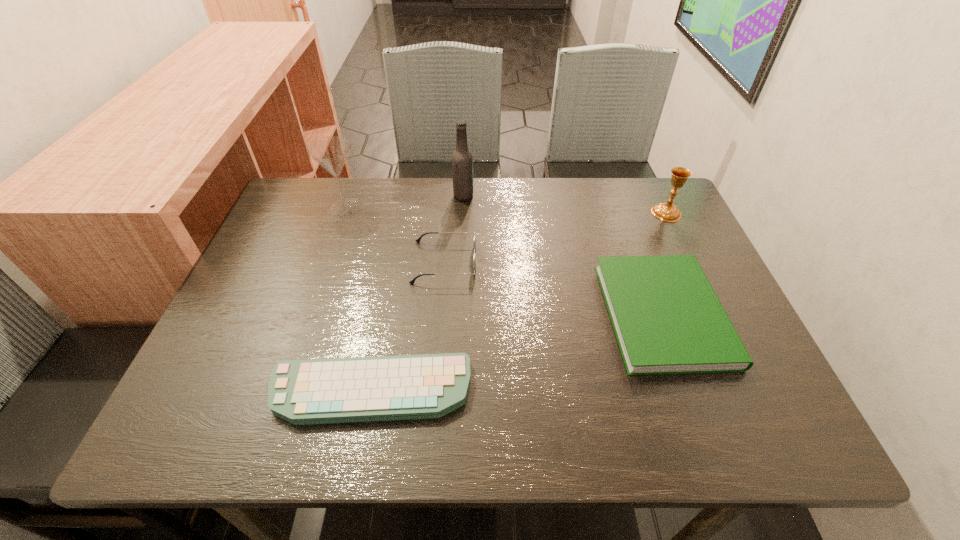
The width and height of the screenshot is (960, 540). What are the coordinates of `vacant space situated 0.290m on the back of the fifth tallest object` in the screenshot? It's located at point(619,195).

The height and width of the screenshot is (540, 960). In order to click on free space located 0.120m on the right of the shortest object in this screenshot , I will do `click(533, 390)`.

You are a GUI agent. You are given a task and a screenshot of the screen. Output one action in this format:
    pyautogui.click(x=<x>, y=<y>)
    Task: Click on the beer bottle located at the far edge
    The image size is (960, 540).
    Given the screenshot: What is the action you would take?
    pyautogui.click(x=462, y=160)

Locate an element on the screen. This screenshot has width=960, height=540. flute glass situated at the far edge is located at coordinates (331, 152).

Where is `chalice present at the far edge`? chalice present at the far edge is located at coordinates (669, 212).

This screenshot has height=540, width=960. I want to click on object situated at the near edge, so click(x=339, y=390).

This screenshot has height=540, width=960. Find the location of `flute glass located at the left edge`. flute glass located at the left edge is located at coordinates (331, 152).

This screenshot has height=540, width=960. Find the location of `computer keyboard positioned at the left edge`. computer keyboard positioned at the left edge is located at coordinates (339, 390).

Find the location of a particular element. The height and width of the screenshot is (540, 960). chalice that is at the right edge is located at coordinates 669,212.

Find the location of `paperback book positioned at the right edge`. paperback book positioned at the right edge is located at coordinates (667, 319).